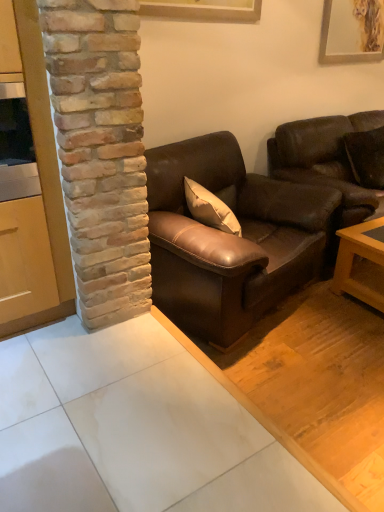
Question: From a real-world perspective, does brown leather pillow at upper right sit lower than matte gold picture frame at upper right, which appears as the second picture frame when viewed from the left?

Choices:
 (A) no
 (B) yes

Answer: (B)

Question: Is brown leather pillow at upper right outside matte gold picture frame at upper right, the first picture frame viewed from the back?

Choices:
 (A) no
 (B) yes

Answer: (B)

Question: From the image's perspective, is brown leather pillow at upper right below matte gold picture frame at upper right, which appears as the second picture frame when viewed from the left?

Choices:
 (A) yes
 (B) no

Answer: (A)

Question: Is brown leather pillow at upper right further to camera compared to matte gold picture frame at upper right, which appears as the second picture frame when viewed from the left?

Choices:
 (A) no
 (B) yes

Answer: (A)

Question: Is brown leather pillow at upper right bigger than matte gold picture frame at upper right, the first picture frame viewed from the back?

Choices:
 (A) yes
 (B) no

Answer: (A)

Question: Can you confirm if brown leather pillow at upper right is positioned to the right of matte gold picture frame at upper right, the first picture frame viewed from the right?

Choices:
 (A) yes
 (B) no

Answer: (A)

Question: Is the position of wooden picture frame at upper center, which is counted as the second picture frame, starting from the back, more distant than that of wooden cabinet at left?

Choices:
 (A) yes
 (B) no

Answer: (A)

Question: Could you tell me if wooden picture frame at upper center, which ranks as the first picture frame in left-to-right order, is facing wooden cabinet at left?

Choices:
 (A) yes
 (B) no

Answer: (B)

Question: Is wooden picture frame at upper center, which is counted as the second picture frame, starting from the back, facing away from wooden cabinet at left?

Choices:
 (A) yes
 (B) no

Answer: (B)

Question: Is wooden picture frame at upper center, which is counted as the second picture frame, starting from the back, closer to the viewer compared to wooden cabinet at left?

Choices:
 (A) yes
 (B) no

Answer: (B)

Question: Is wooden picture frame at upper center, which is counted as the second picture frame, starting from the back, in contact with wooden cabinet at left?

Choices:
 (A) no
 (B) yes

Answer: (A)

Question: From the image's perspective, is wooden picture frame at upper center, which is the 1th picture frame from front to back, below wooden cabinet at left?

Choices:
 (A) no
 (B) yes

Answer: (A)

Question: Does brown leather couch at center, the first studio couch from the left, appear on the right side of wooden cabinet at left?

Choices:
 (A) no
 (B) yes

Answer: (B)